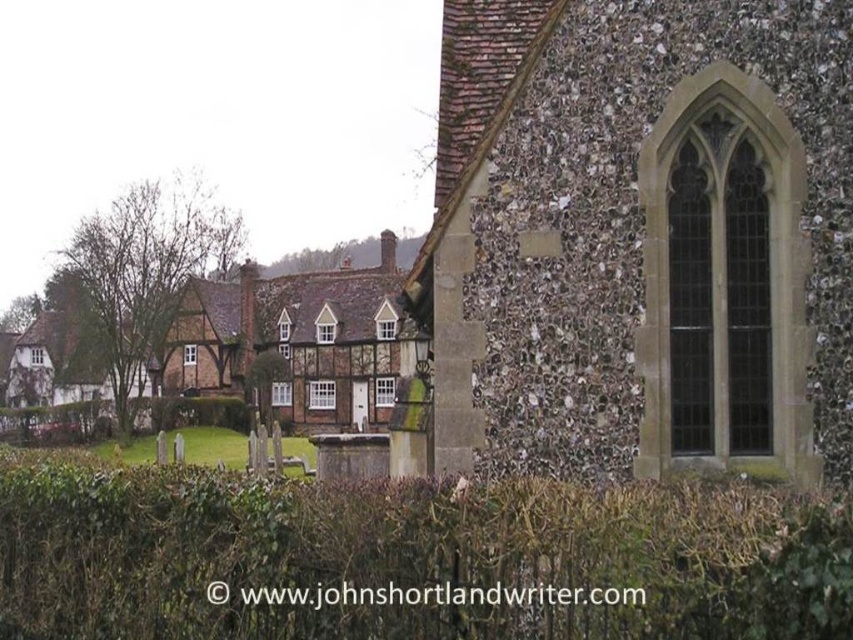
Consider the image. You are a tour guide leading a group to the historic church. You notice the green leafy hedge at center and the speckled stone church at center. How far apart are these two landmarks?

The speckled stone church at center and the green leafy hedge at center are 22.05 feet apart from each other.

You are standing in the village square and see the speckled stone church at center and the green leafy hedge at center. Which object is positioned higher in the image?

The speckled stone church at center is positioned higher than the green leafy hedge at center in the image.

You are standing in the village square and want to take a photo of the speckled stone church at center. Your camera has a maximum focus range of 25 meters. Will you be able to capture the church clearly?

The speckled stone church at center is 25.01 meters away from the viewer. Since the camera can only focus up to 25 meters, it cannot capture the church clearly at this distance.